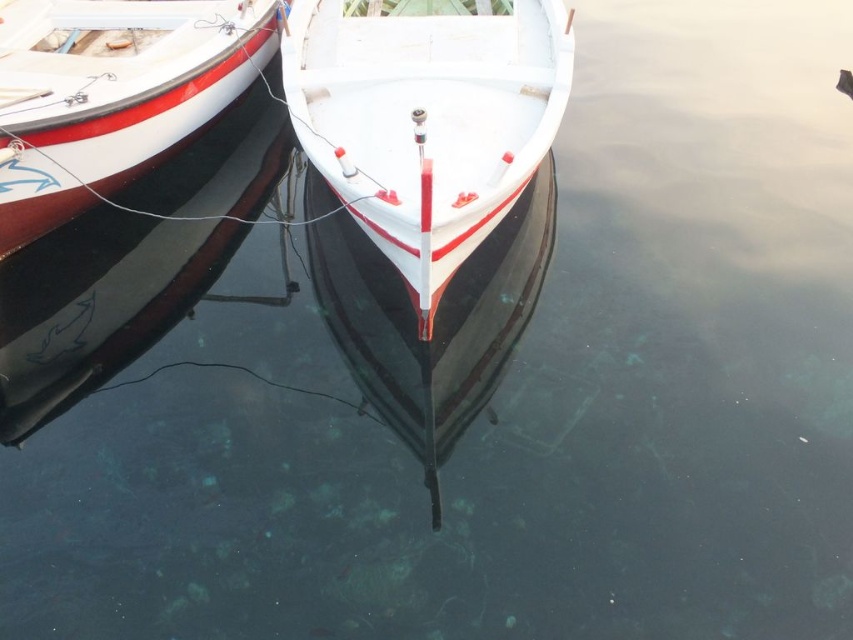
In the scene shown: You are a marine biologist assessing boat stability. The white matte boat at center and the white glossy boat at center are both docked. Which boat has a higher center of gravity based on their height?

The white matte boat at center has a greater height compared to the white glossy boat at center, so it likely has a higher center of gravity.

You are standing on the dock and see two points marked on the water surface. The first point is at coordinate point(561, 116) and the second is at point(202, 72). Which point is closer to you?

Point(561, 116) is in front of point(202, 72), so it is closer to you.

You are standing on the dock and want to board one of the two boats. The white matte boat at center is 1.70 meters away from the white glossy boat at center. Which boat is closer to you?

The white matte boat at center is 1.70 meters away from the white glossy boat at center, so whichever boat you are closer to would depend on your position. However, since both are at the center, they are equidistant from you.